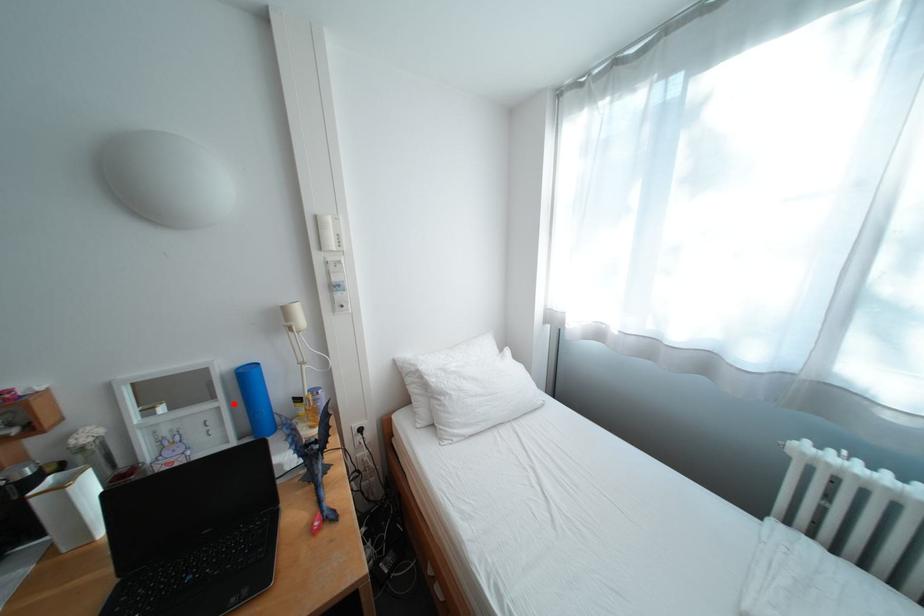
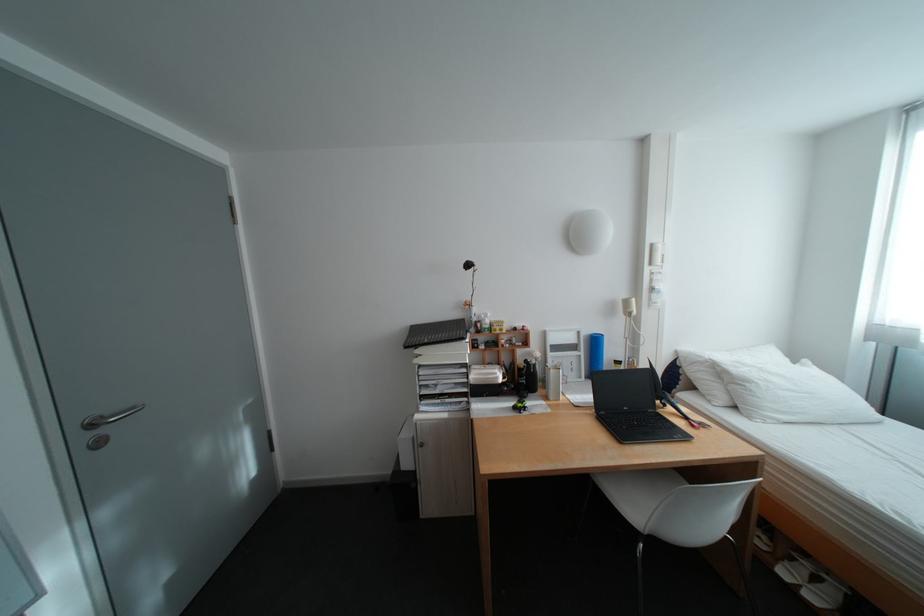
Where in the second image is the point corresponding to the highlighted location from the first image?

(594, 354)